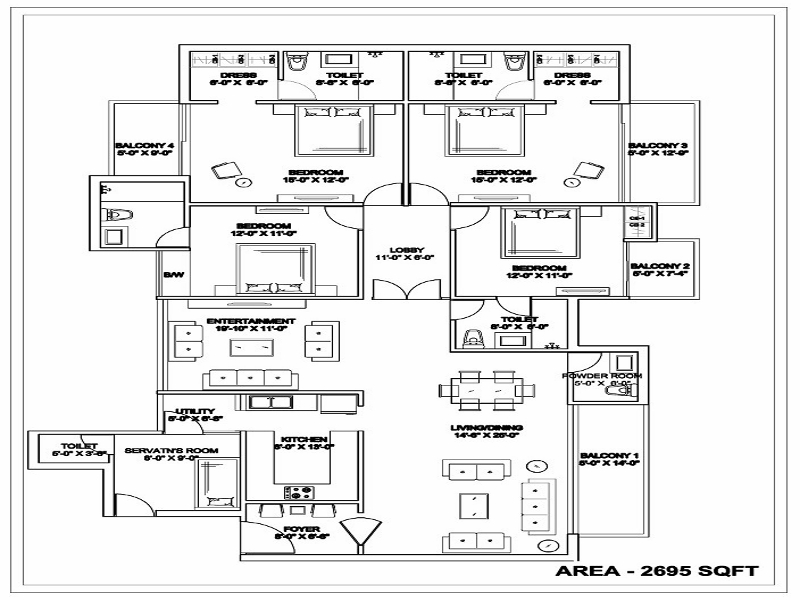
You are a GUI agent. You are given a task and a screenshot of the screen. Output one action in this format:
    pyautogui.click(x=<x>, y=<y>)
    Task: Click on the kitchen
    This screenshot has width=800, height=600.
    Given the screenshot: What is the action you would take?
    pyautogui.click(x=300, y=436)